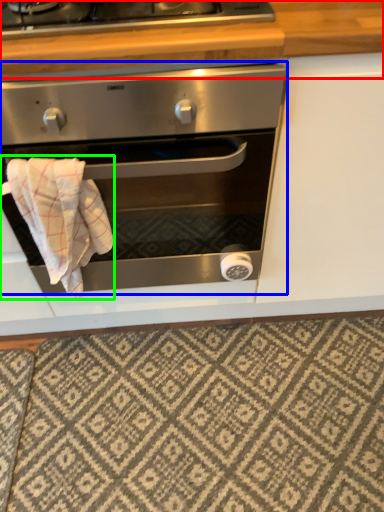
Question: Considering the real-world distances, which object is closest to counter top (highlighted by a red box)? oven (highlighted by a blue box) or bath towel (highlighted by a green box).

Choices:
 (A) oven
 (B) bath towel

Answer: (A)